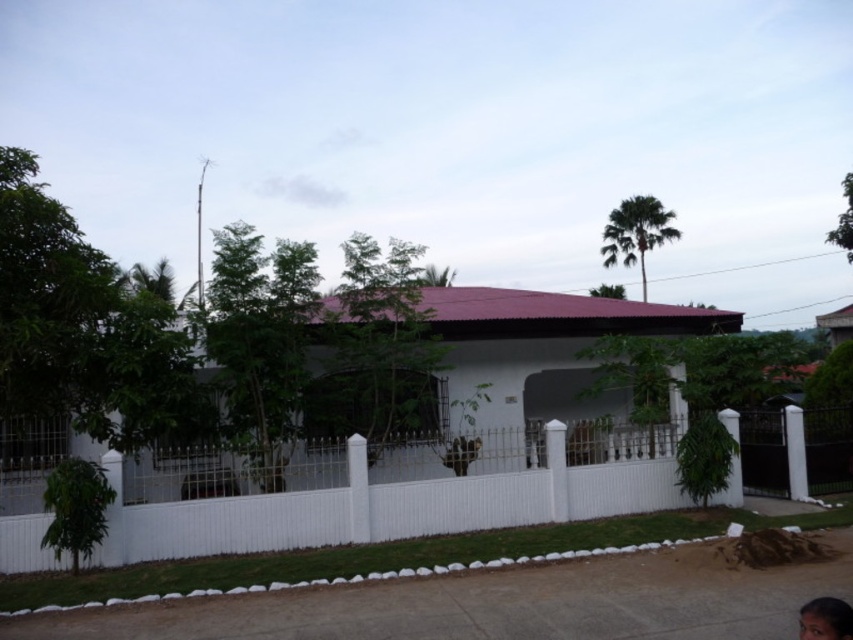
Is white picket fence at center to the left of smooth skin face at lower right from the viewer's perspective?

Yes, white picket fence at center is to the left of smooth skin face at lower right.

Consider the image. Does white picket fence at center have a larger size compared to smooth skin face at lower right?

No, white picket fence at center is not bigger than smooth skin face at lower right.

The width and height of the screenshot is (853, 640). What are the coordinates of `white picket fence at center` in the screenshot? It's located at (383, 508).